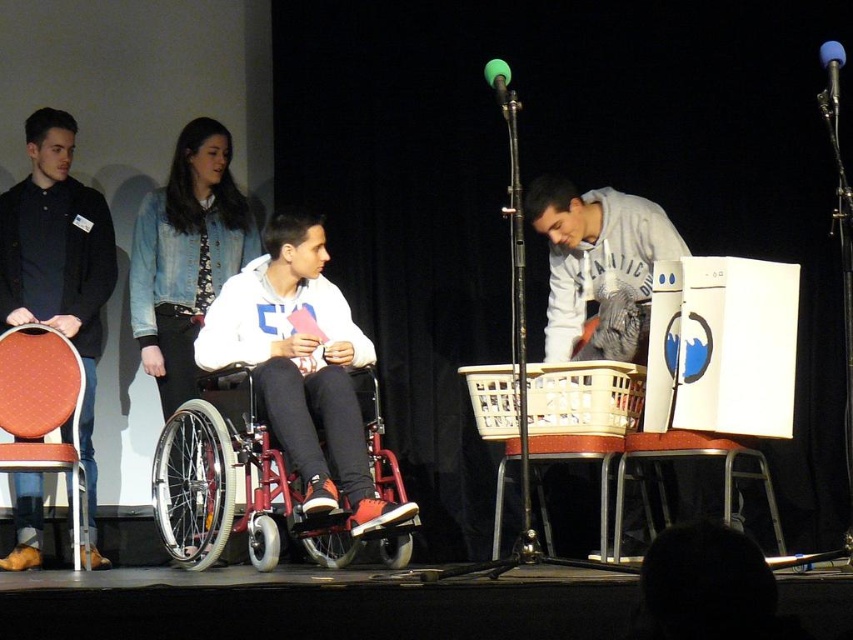
You are an event organizer setting up the stage for a presentation. You need to place a new speaker who requires a microphone. The stage currently has a blue foam microphone at upper right and a green matte microphone at upper center. Which microphone should the speaker use if they want the one that is positioned lower on the stage?

The blue foam microphone at upper right is positioned below the green matte microphone at upper center, so the speaker should use the blue foam microphone at upper right if they want the one that is lower on the stage.

You are a stagehand setting up for a presentation. You need to place a new microphone stand exactly where the blue foam microphone at upper right is currently located. What are the coordinates where you should position the new stand?

The blue foam microphone at upper right is located at coordinates point (831, 74), so you should position the new stand there.